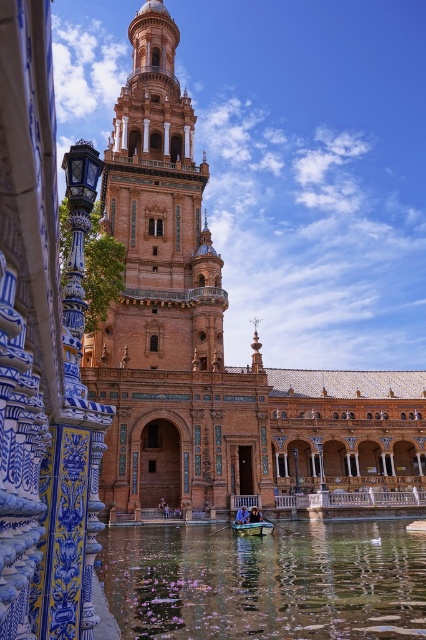
You are a tourist standing at the edge of the water in the Plaza de Espana. You want to take a photo of the brown textured stone palace at center and the clear water at center. Which object will appear wider in your photo?

The brown textured stone palace at center will appear wider in the photo because its width is larger than the clear water at center.

You are standing at the Plaza de Espana in Seville, Spain, and you see two points marked in the scene. The first point is at coordinates point (331, 378) and the second point is at point (134, 108). Which of these two points is closer to your viewpoint?

Point (134, 108) is closer to your viewpoint because the description states that point (331, 378) is further away from the camera than point (134, 108).